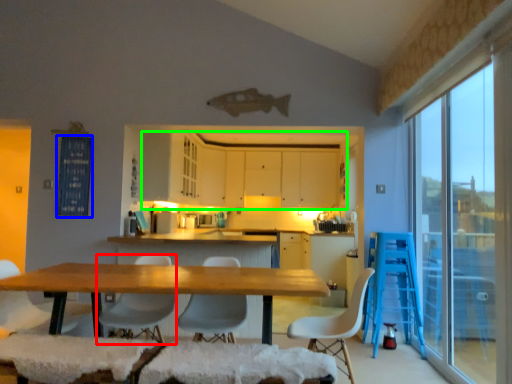
Question: Which object is positioned closest to chair (highlighted by a red box)? Select from window screen (highlighted by a blue box) and cabinetry (highlighted by a green box).

Choices:
 (A) window screen
 (B) cabinetry

Answer: (A)